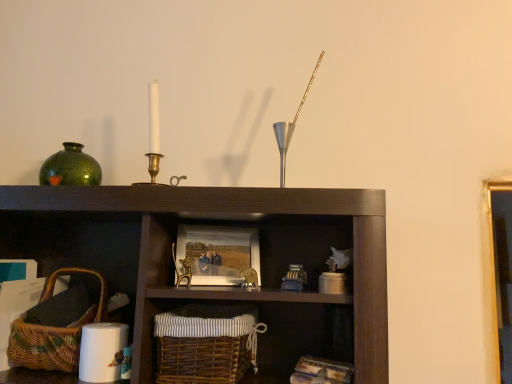
Question: Does woven brown basket at lower left, the 1th basket viewed from the left, have a lesser width compared to green glossy vase at upper left?

Choices:
 (A) no
 (B) yes

Answer: (A)

Question: Is woven brown basket at lower left, which appears as the 2th basket when viewed from the right, positioned before green glossy vase at upper left?

Choices:
 (A) no
 (B) yes

Answer: (B)

Question: Considering the relative sizes of woven brown basket at lower left, the 1th basket viewed from the left, and green glossy vase at upper left in the image provided, is woven brown basket at lower left, the 1th basket viewed from the left, shorter than green glossy vase at upper left?

Choices:
 (A) yes
 (B) no

Answer: (B)

Question: Is woven brown basket at lower left, the 1th basket viewed from the left, far from green glossy vase at upper left?

Choices:
 (A) yes
 (B) no

Answer: (B)

Question: Does woven brown basket at lower left, which appears as the 2th basket when viewed from the right, appear on the left side of green glossy vase at upper left?

Choices:
 (A) no
 (B) yes

Answer: (A)

Question: Considering the positions of wooden picture frame at center and woven brown basket at lower center, the second basket viewed from the left, in the image, is wooden picture frame at center taller or shorter than woven brown basket at lower center, the second basket viewed from the left,?

Choices:
 (A) tall
 (B) short

Answer: (B)

Question: From the image's perspective, is wooden picture frame at center located above or below woven brown basket at lower center, placed as the 1th basket when sorted from right to left?

Choices:
 (A) below
 (B) above

Answer: (B)

Question: Is wooden picture frame at center wider or thinner than woven brown basket at lower center, placed as the 1th basket when sorted from right to left?

Choices:
 (A) wide
 (B) thin

Answer: (B)

Question: Considering the relative positions of wooden picture frame at center and woven brown basket at lower center, the second basket viewed from the left, in the image provided, is wooden picture frame at center to the left or to the right of woven brown basket at lower center, the second basket viewed from the left,?

Choices:
 (A) right
 (B) left

Answer: (A)

Question: Considering the positions of green glossy vase at upper left and woven brown basket at lower center, the second basket viewed from the left, in the image, is green glossy vase at upper left wider or thinner than woven brown basket at lower center, the second basket viewed from the left,?

Choices:
 (A) thin
 (B) wide

Answer: (A)

Question: From the image's perspective, is green glossy vase at upper left positioned above or below woven brown basket at lower center, placed as the 1th basket when sorted from right to left?

Choices:
 (A) below
 (B) above

Answer: (B)

Question: Considering the positions of green glossy vase at upper left and woven brown basket at lower center, placed as the 1th basket when sorted from right to left, in the image, is green glossy vase at upper left taller or shorter than woven brown basket at lower center, placed as the 1th basket when sorted from right to left,?

Choices:
 (A) short
 (B) tall

Answer: (A)

Question: From a real-world perspective, is green glossy vase at upper left physically located above or below woven brown basket at lower center, the second basket viewed from the left?

Choices:
 (A) below
 (B) above

Answer: (B)

Question: From a real-world perspective, is green glossy vase at upper left above or below metallic silver candle holder at upper center?

Choices:
 (A) above
 (B) below

Answer: (B)

Question: Is green glossy vase at upper left in front of or behind metallic silver candle holder at upper center in the image?

Choices:
 (A) behind
 (B) front

Answer: (A)